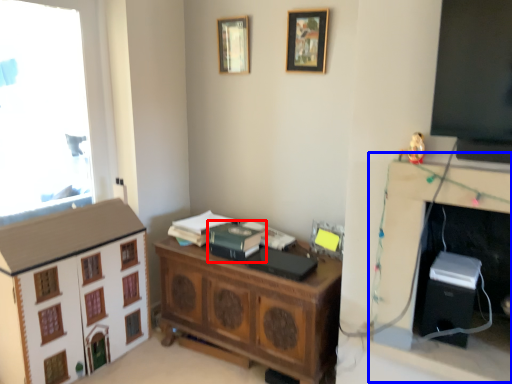
Question: Among these objects, which one is nearest to the camera, book (highlighted by a red box) or computer desk (highlighted by a blue box)?

Choices:
 (A) book
 (B) computer desk

Answer: (B)